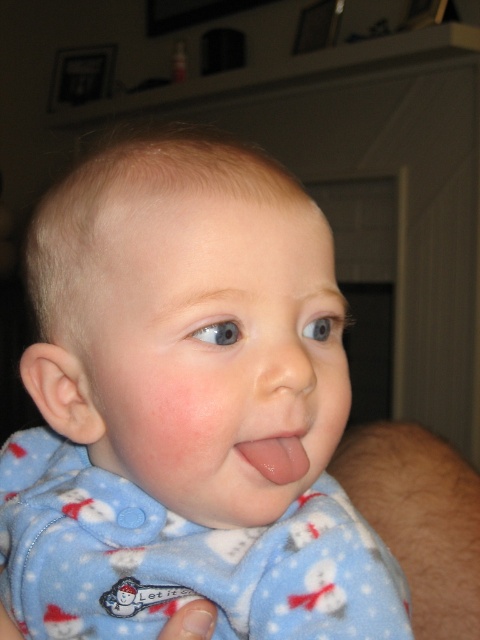
Who is higher up, smooth flesh nose at center or glossy pink tongue at center?

smooth flesh nose at center is above.

Locate an element on the screen. This screenshot has width=480, height=640. smooth flesh nose at center is located at coordinates (288, 362).

The image size is (480, 640). Describe the element at coordinates (288, 362) in the screenshot. I see `smooth flesh nose at center` at that location.

Locate an element on the screen. This screenshot has height=640, width=480. smooth flesh nose at center is located at coordinates (288, 362).

Is blue fleece pajamas at center shorter than glossy pink tongue at center?

No.

Is blue fleece pajamas at center positioned in front of glossy pink tongue at center?

Yes.

You are a GUI agent. You are given a task and a screenshot of the screen. Output one action in this format:
    pyautogui.click(x=<x>, y=<y>)
    Task: Click on the blue fleece pajamas at center
    This screenshot has height=640, width=480.
    Given the screenshot: What is the action you would take?
    pyautogui.click(x=181, y=412)

You are a GUI agent. You are given a task and a screenshot of the screen. Output one action in this format:
    pyautogui.click(x=<x>, y=<y>)
    Task: Click on the blue fleece pajamas at center
    This screenshot has width=480, height=640.
    Given the screenshot: What is the action you would take?
    pyautogui.click(x=181, y=412)

Which is more to the left, blue fleece pajamas at center or smooth flesh nose at center?

Positioned to the left is blue fleece pajamas at center.

Which is below, blue fleece pajamas at center or smooth flesh nose at center?

blue fleece pajamas at center is lower down.

Identify the location of blue fleece pajamas at center. The width and height of the screenshot is (480, 640). (181, 412).

I want to click on blue fleece pajamas at center, so click(181, 412).